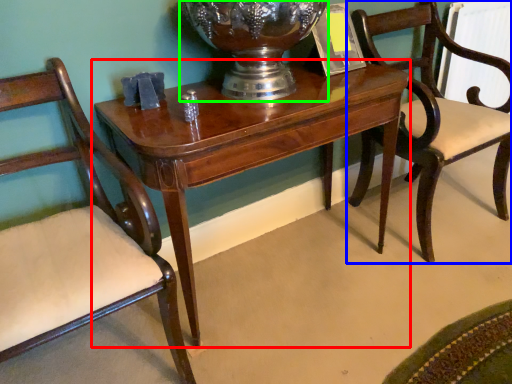
Question: Which is nearer to the table (highlighted by a red box)? chair (highlighted by a blue box) or glass vase (highlighted by a green box).

Choices:
 (A) chair
 (B) glass vase

Answer: (B)